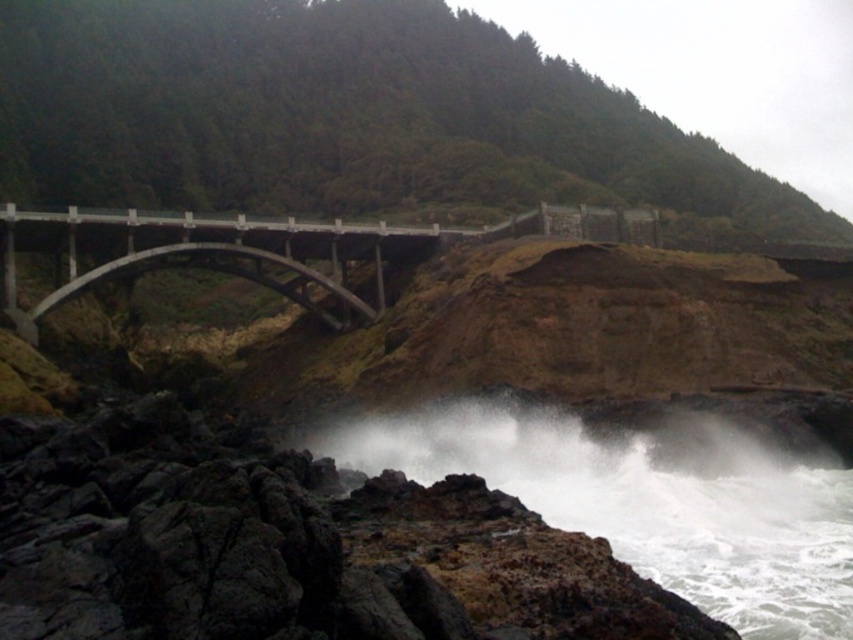
Can you confirm if white frothy water at lower center is smaller than concrete bridge at center?

Indeed, white frothy water at lower center has a smaller size compared to concrete bridge at center.

Who is more distant from viewer, (634, 506) or (260, 230)?

The point (260, 230) is behind.

Does point (697, 538) come behind point (234, 227)?

No, (697, 538) is in front of (234, 227).

Locate an element on the screen. This screenshot has height=640, width=853. white frothy water at lower center is located at coordinates (645, 499).